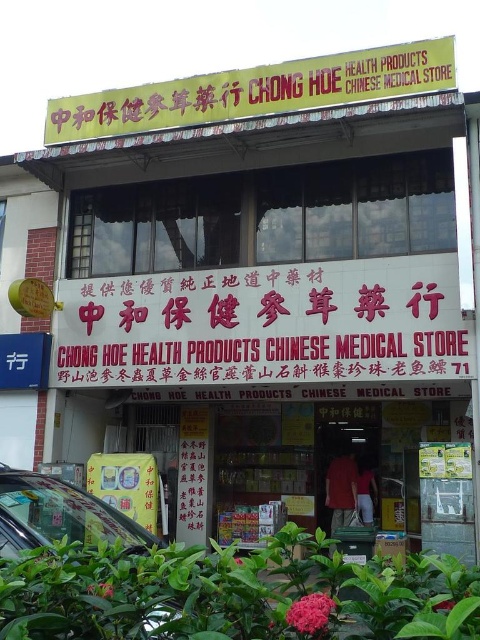
You are a customer standing in front of the Chinese medical store. You notice two yellow signs. The first is the yellow cardboard sign at center, and the second is the yellow matte signboard at upper center. Which sign do you have to look at first as you face the store?

The yellow cardboard sign at center is closer to you, so you will look at it first before the yellow matte signboard at upper center.

You are standing in front of the Chong Hoe Health Products Chinese Medical Store. There is a pink paper sign at center. Where is the pink paper sign located in relation to the store entrance?

The pink paper sign at center is located at the center of the store entrance area.

Consider the image. You are a customer standing in front of the Chinese medical store. You see two yellow signs, the yellow cardboard sign at center and the yellow matte signboard at upper center. Which one is more to the right?

The yellow cardboard sign at center is positioned on the right side of yellow matte signboard at upper center, so it is more to the right.